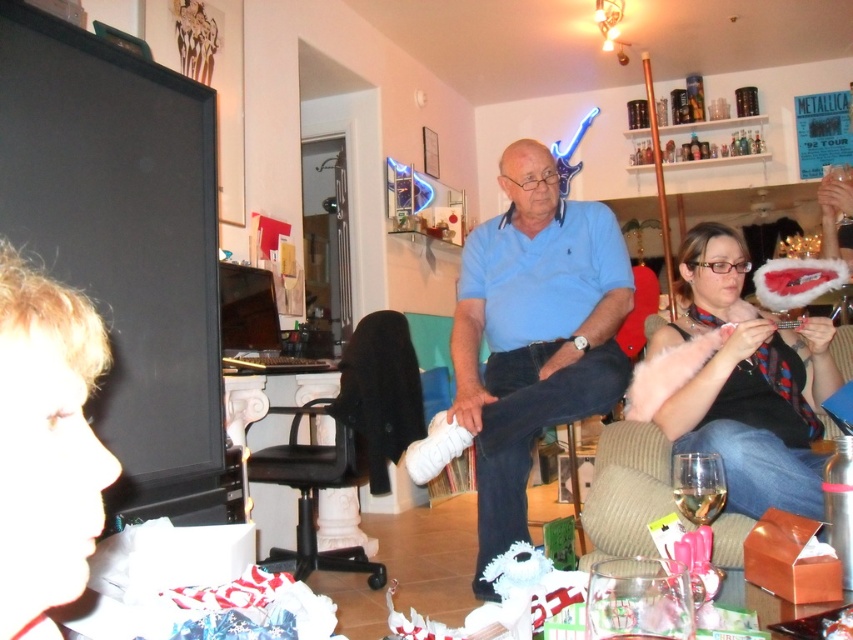
In order to click on matte black purse at lower right in this screenshot , I will do `click(747, 384)`.

The image size is (853, 640). I want to click on matte black purse at lower right, so click(747, 384).

Is the position of blue cotton shirt at center more distant than that of matte black purse at lower right?

Yes, blue cotton shirt at center is behind matte black purse at lower right.

Is blue cotton shirt at center below matte black purse at lower right?

No, blue cotton shirt at center is not below matte black purse at lower right.

I want to click on blue cotton shirt at center, so click(x=532, y=333).

I want to click on blue cotton shirt at center, so click(x=532, y=333).

Describe the element at coordinates (347, 440) in the screenshot. I see `black leather chair at center` at that location.

Who is higher up, black leather chair at center or brown fabric armchair at lower right?

brown fabric armchair at lower right is above.

Locate an element on the screen. This screenshot has width=853, height=640. black leather chair at center is located at coordinates click(347, 440).

Where is `black leather chair at center`? The height and width of the screenshot is (640, 853). black leather chair at center is located at coordinates (347, 440).